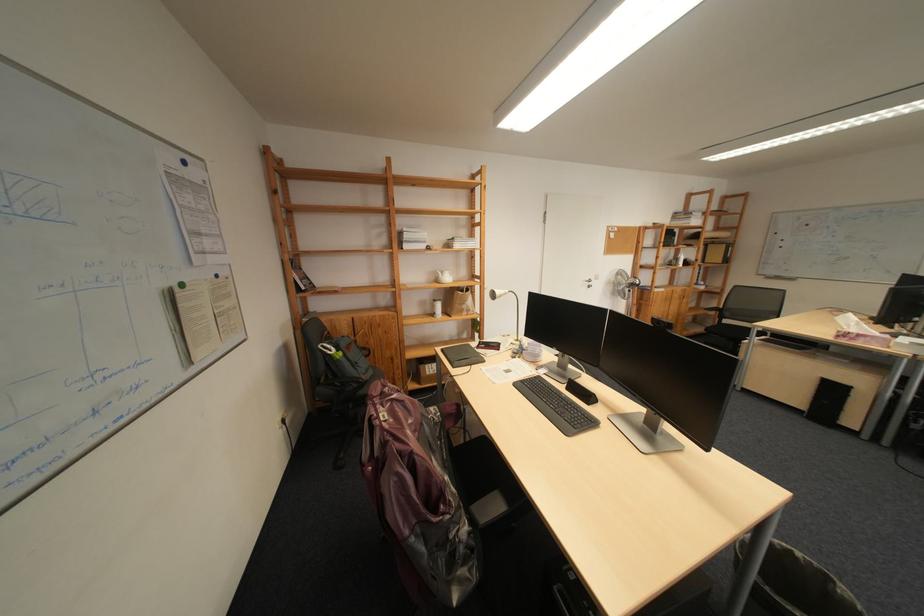
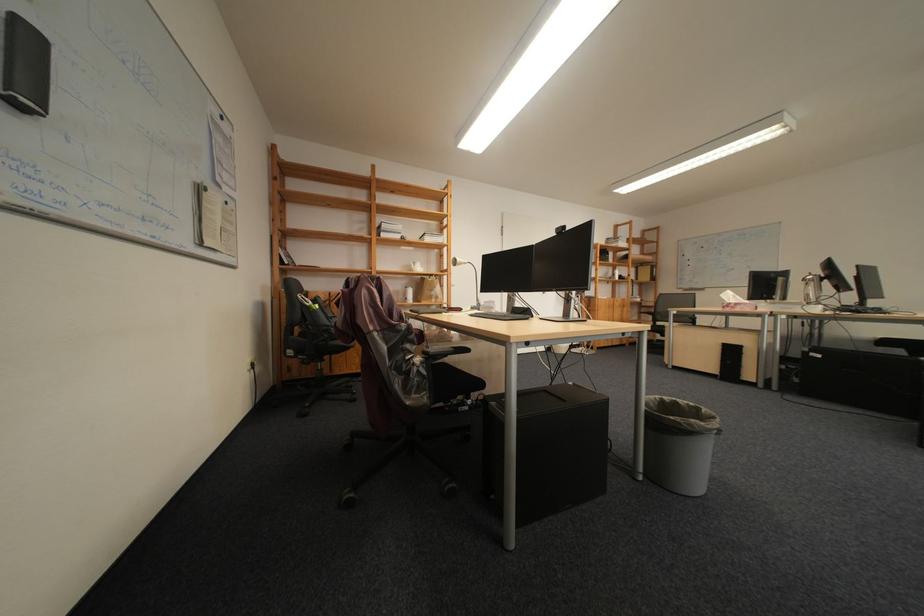
Where in the second image is the point corresponding to point (507, 297) from the first image?

(468, 264)